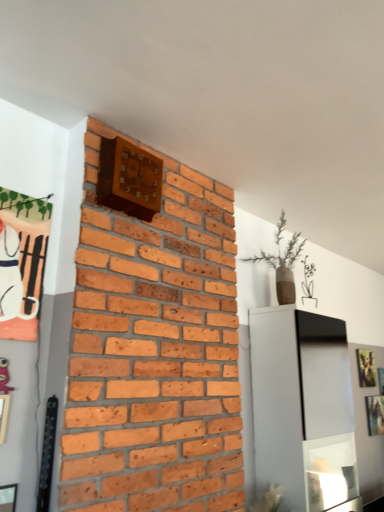
Question: In terms of size, does green leafy plant at lower center appear bigger or smaller than metallic silver picture frame at upper right, which is the second picture frame in back-to-front order?

Choices:
 (A) big
 (B) small

Answer: (A)

Question: Choose the correct answer: Is green leafy plant at lower center inside metallic silver picture frame at upper right, which is the first picture frame in bottom-to-top order, or outside it?

Choices:
 (A) inside
 (B) outside

Answer: (B)

Question: Which object is positioned closest to the matte orange fabric picture frame at upper left, the first picture frame in the front-to-back sequence?

Choices:
 (A) green leafy plant at lower center
 (B) metallic silver picture frame at upper right, which appears as the third picture frame when viewed from the left
 (C) gold metallic picture frame at upper right, placed as the 3th picture frame when sorted from front to back

Answer: (A)

Question: Which is farther from the green leafy plant at lower center?

Choices:
 (A) matte orange fabric picture frame at upper left, the 3th picture frame positioned from the back
 (B) gold metallic picture frame at upper right, the first picture frame from the back
 (C) metallic silver picture frame at upper right, which is the second picture frame in back-to-front order

Answer: (A)